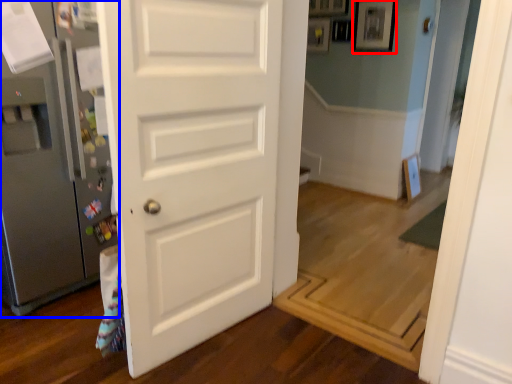
Question: Which object is closer to the camera taking this photo, picture frame (highlighted by a red box) or refrigerator (highlighted by a blue box)?

Choices:
 (A) picture frame
 (B) refrigerator

Answer: (B)